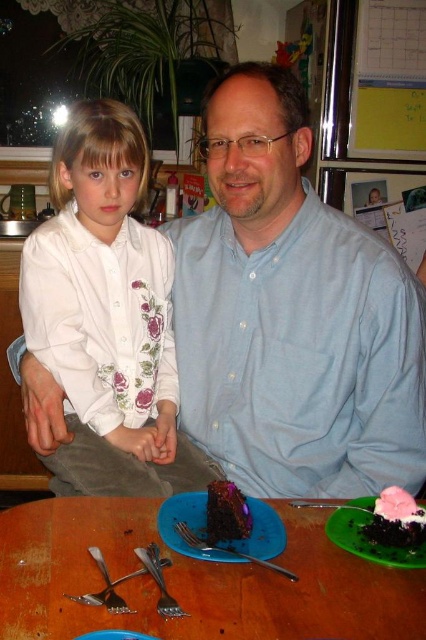
Who is more forward, (x=238, y=145) or (x=357, y=548)?

Point (x=357, y=548) is more forward.

The height and width of the screenshot is (640, 426). I want to click on blue cotton shirt at center, so click(x=291, y=314).

Locate an element on the screen. The width and height of the screenshot is (426, 640). blue cotton shirt at center is located at coordinates (291, 314).

Between blue cotton shirt at center and blue plastic plate at lower center, which one has less height?

With less height is blue plastic plate at lower center.

Looking at this image, who is more forward, (282, 486) or (261, 508)?

Point (261, 508) is in front.

Between point (284, 401) and point (238, 545), which one is positioned behind?

The point (284, 401) is more distant.

The width and height of the screenshot is (426, 640). I want to click on blue cotton shirt at center, so click(x=291, y=314).

Does brown corduroy pants at center have a lesser height compared to metallic silver fork at center?

No, brown corduroy pants at center is not shorter than metallic silver fork at center.

Can you confirm if brown corduroy pants at center is bigger than metallic silver fork at center?

Yes, brown corduroy pants at center is bigger than metallic silver fork at center.

Find the location of a particular element. brown corduroy pants at center is located at coordinates pyautogui.click(x=123, y=467).

This screenshot has height=640, width=426. I want to click on brown corduroy pants at center, so click(123, 467).